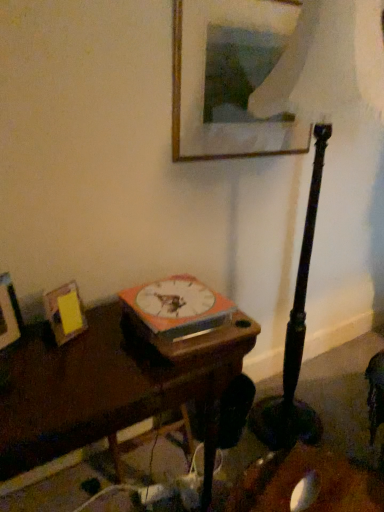
I want to click on vacant area in front of yellow paper at left, the 2th picture frame viewed from the right, so click(66, 368).